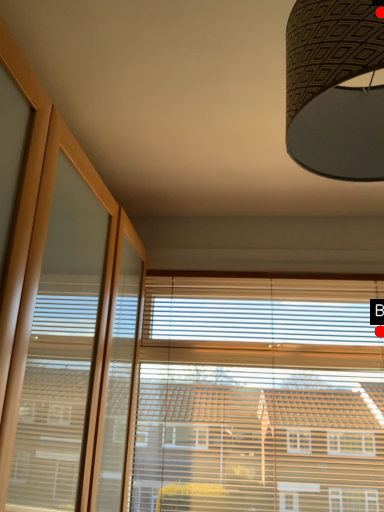
Question: Two points are circled on the image, labeled by A and B beside each circle. Which point is further to the camera?

Choices:
 (A) A is further
 (B) B is further

Answer: (B)